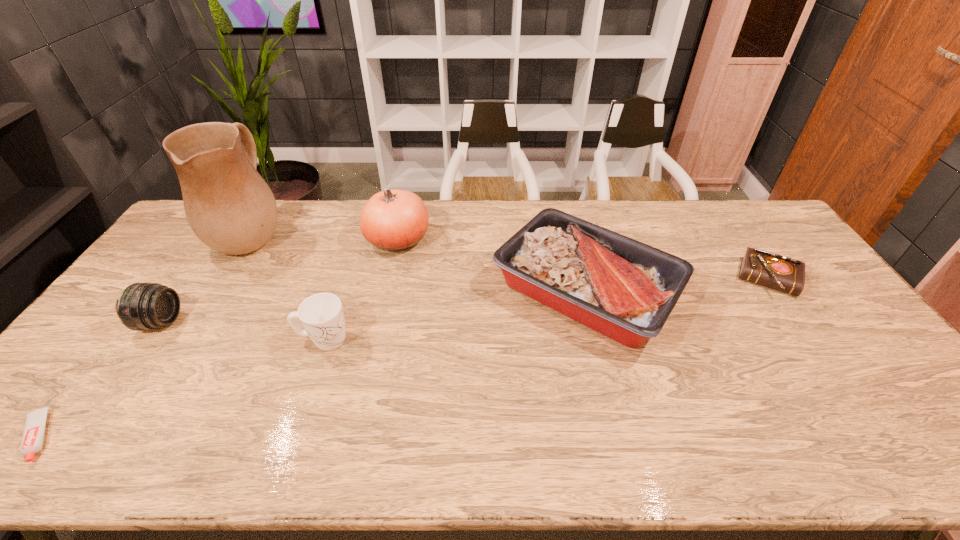
At what (x,y) coordinates should I click in order to perform the action: click on cream pitcher. Please return your answer as a coordinate pair (x, y). Looking at the image, I should click on (230, 208).

Locate an element on the screen. This screenshot has height=540, width=960. the sixth shortest object is located at coordinates (394, 220).

Where is `tray`? tray is located at coordinates (624, 289).

Where is `telephoto lens`? The height and width of the screenshot is (540, 960). telephoto lens is located at coordinates (142, 306).

Where is `mug`? mug is located at coordinates (322, 316).

This screenshot has width=960, height=540. Identify the location of diary. (781, 273).

Find the location of a particular element. the rightmost object is located at coordinates (781, 273).

The height and width of the screenshot is (540, 960). What are the coordinates of `vacant area located 0.100m at the spout of the tallest object` in the screenshot? It's located at (318, 233).

Identify the location of free region located 0.340m on the right of the sixth shortest object. (528, 240).

This screenshot has height=540, width=960. I want to click on vacant space located 0.160m on the right of the tray, so click(x=733, y=291).